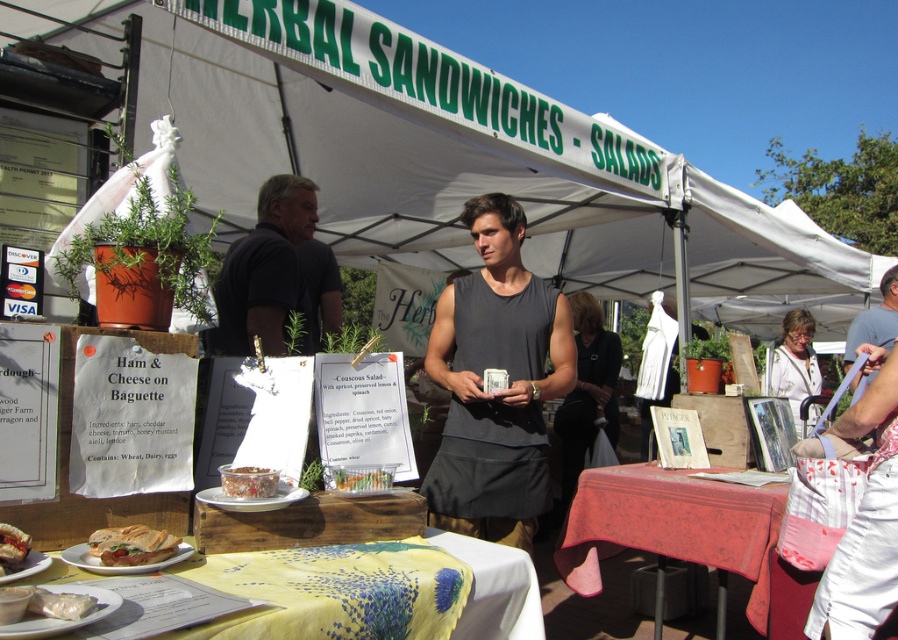
Is dark gray sleeveless tank top at center to the right of matte brown sandwich at lower left from the viewer's perspective?

Indeed, dark gray sleeveless tank top at center is positioned on the right side of matte brown sandwich at lower left.

What do you see at coordinates (498, 390) in the screenshot? The image size is (898, 640). I see `dark gray sleeveless tank top at center` at bounding box center [498, 390].

This screenshot has height=640, width=898. In order to click on dark gray sleeveless tank top at center in this screenshot , I will do `click(498, 390)`.

Is red fabric tablecloth at lower center taller than shiny plastic container at center?

Indeed, red fabric tablecloth at lower center has a greater height compared to shiny plastic container at center.

Is red fabric tablecloth at lower center to the right of shiny plastic container at center from the viewer's perspective?

Indeed, red fabric tablecloth at lower center is positioned on the right side of shiny plastic container at center.

Is point (639, 500) positioned in front of point (226, 484)?

No.

This screenshot has width=898, height=640. Find the location of `red fabric tablecloth at lower center`. red fabric tablecloth at lower center is located at coordinates (670, 525).

How distant is white fabric at center from matte brown sandwich at lower left?

5.20 meters

How distant is white fabric at center from matte brown sandwich at lower left?

5.20 meters

What do you see at coordinates (794, 364) in the screenshot? I see `white fabric at center` at bounding box center [794, 364].

Locate an element on the screen. The image size is (898, 640). white fabric at center is located at coordinates click(794, 364).